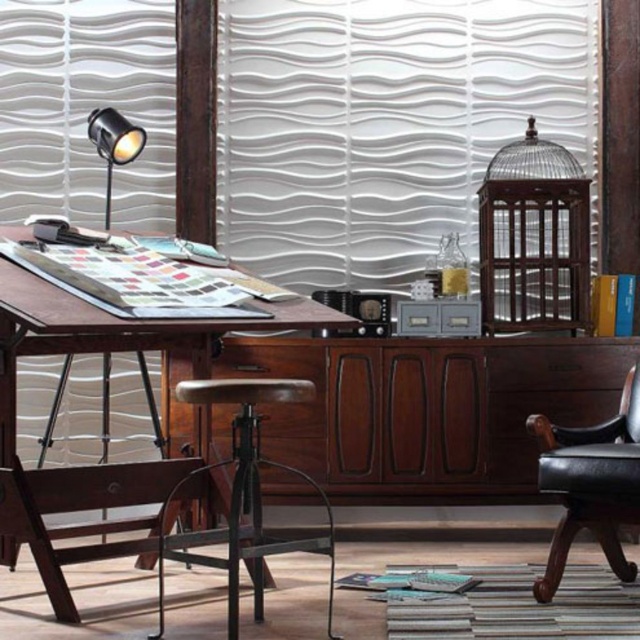
Does rustic wood stool at center have a smaller size compared to matte black spotlight at upper left?

No.

Can you confirm if rustic wood stool at center is positioned to the left of matte black spotlight at upper left?

In fact, rustic wood stool at center is to the right of matte black spotlight at upper left.

Locate an element on the screen. The width and height of the screenshot is (640, 640). rustic wood stool at center is located at coordinates (243, 496).

Identify the location of rustic wood stool at center. (243, 496).

Is rustic wood stool at center above black leather armchair at lower right?

No, rustic wood stool at center is not above black leather armchair at lower right.

The height and width of the screenshot is (640, 640). In order to click on rustic wood stool at center in this screenshot , I will do `click(243, 496)`.

Who is lower down, wooden swivel chair at lower left or black leather armchair at lower right?

Positioned lower is wooden swivel chair at lower left.

Is point (20, 515) positioned behind point (552, 480)?

No, it is in front of (552, 480).

Which is in front, point (1, 484) or point (625, 561)?

Point (1, 484) is more forward.

You are a GUI agent. You are given a task and a screenshot of the screen. Output one action in this format:
    pyautogui.click(x=<x>, y=<y>)
    Task: Click on the wooden swivel chair at lower left
    The image size is (640, 640).
    Given the screenshot: What is the action you would take?
    pyautogui.click(x=83, y=509)